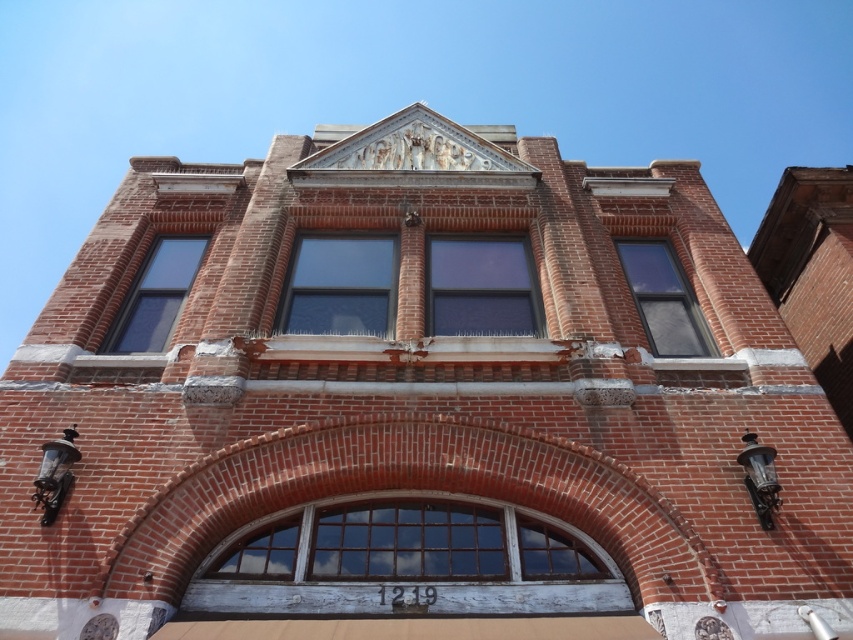
Between transparent glass window at center and clear glass window at right, which one is positioned lower?

clear glass window at right is below.

Is transparent glass window at center further to camera compared to clear glass window at right?

Yes.

What do you see at coordinates (480, 285) in the screenshot? This screenshot has height=640, width=853. I see `transparent glass window at center` at bounding box center [480, 285].

Find the location of a particular element. transparent glass window at center is located at coordinates (480, 285).

Can you confirm if clear glass window at right is positioned below matte glass window at upper left?

Indeed, clear glass window at right is positioned under matte glass window at upper left.

How far apart are clear glass window at right and matte glass window at upper left?

clear glass window at right is 5.21 meters away from matte glass window at upper left.

The height and width of the screenshot is (640, 853). Identify the location of clear glass window at right. (664, 300).

Who is positioned more to the right, clear glass window at center or transparent glass window at center?

Positioned to the right is transparent glass window at center.

Can you confirm if clear glass window at center is positioned to the right of transparent glass window at center?

In fact, clear glass window at center is to the left of transparent glass window at center.

Is point (306, 237) positioned after point (451, 269)?

Yes, it is behind point (451, 269).

The image size is (853, 640). Find the location of `clear glass window at center`. clear glass window at center is located at coordinates (339, 285).